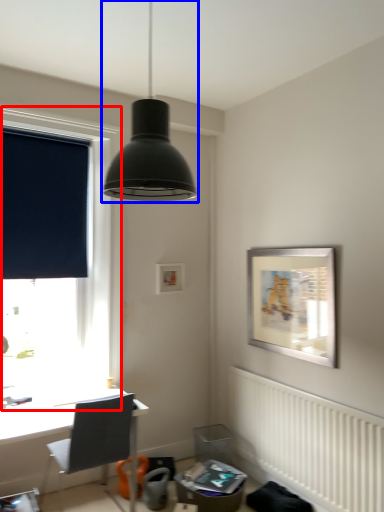
Question: Which of the following is the closest to the observer, window (highlighted by a red box) or lamp (highlighted by a blue box)?

Choices:
 (A) window
 (B) lamp

Answer: (B)